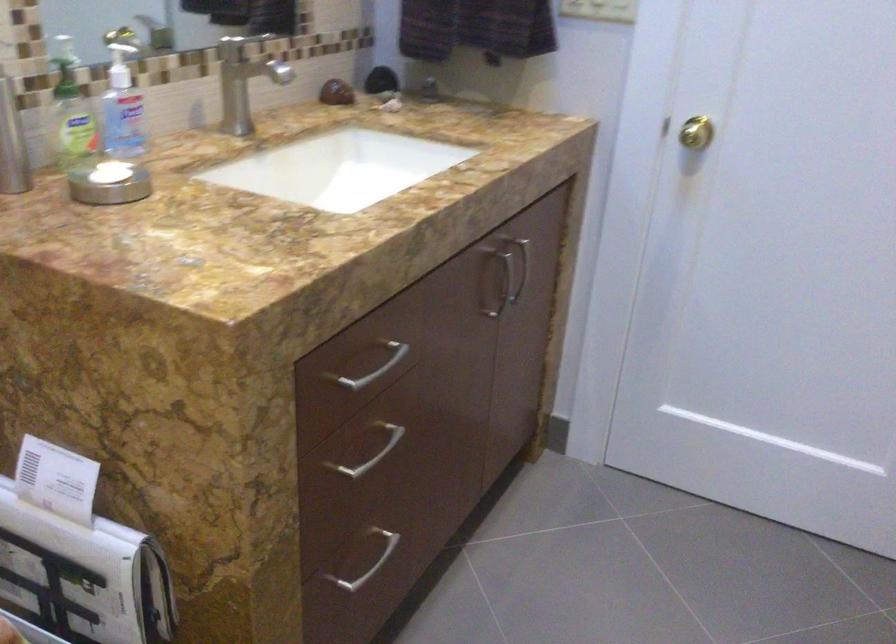
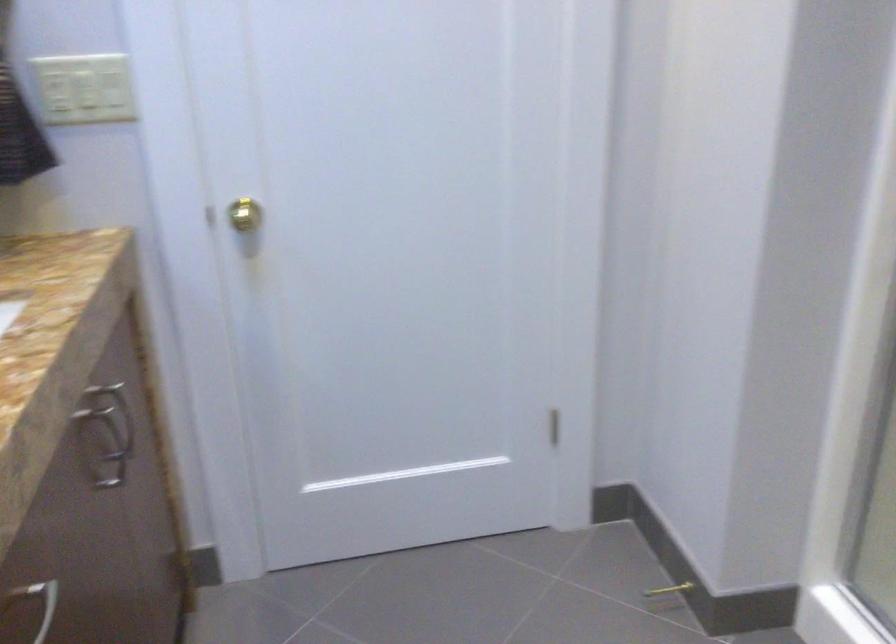
Question: The camera is either moving clockwise (left) or counter-clockwise (right) around the object. The first image is from the beginning of the video and the second image is from the end. Is the camera moving left or right when shooting the video?

Choices:
 (A) Left
 (B) Right

Answer: (A)